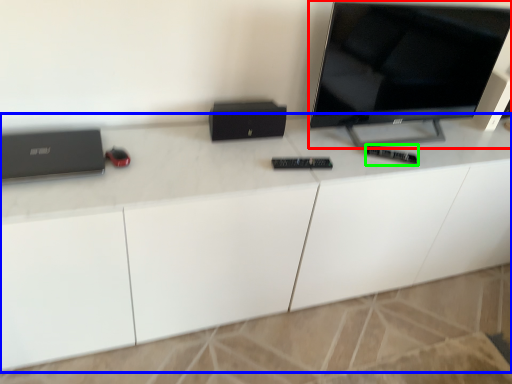
Question: Which object is positioned closest to television (highlighted by a red box)? Select from desk (highlighted by a blue box) and control (highlighted by a green box).

Choices:
 (A) desk
 (B) control

Answer: (B)